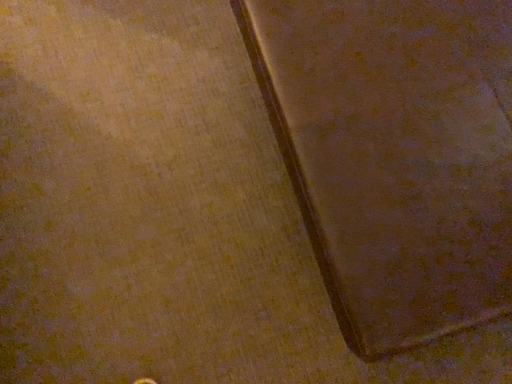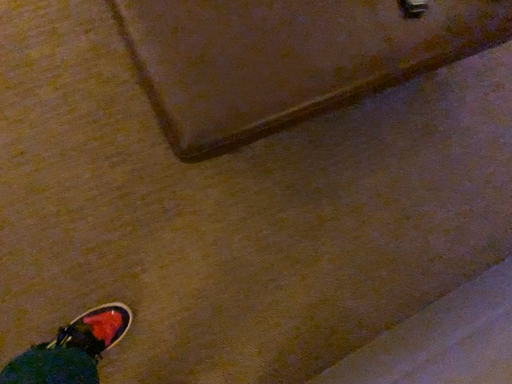
Question: Which way did the camera rotate in the video?

Choices:
 (A) rotated left
 (B) rotated right

Answer: (B)